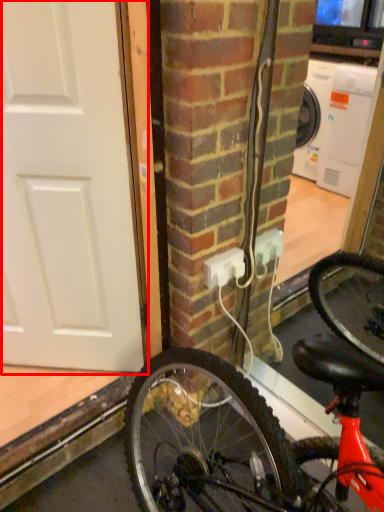
Question: From the image's perspective, considering the relative positions of door (annotated by the red box) and power outlet in the image provided, where is door (annotated by the red box) located with respect to the staircase?

Choices:
 (A) below
 (B) above

Answer: (B)